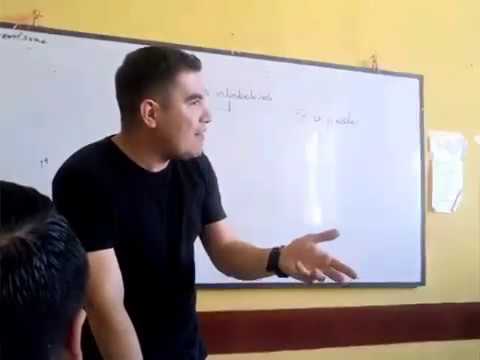
The height and width of the screenshot is (360, 480). What are the coordinates of `1 board` in the screenshot? It's located at (49, 114).